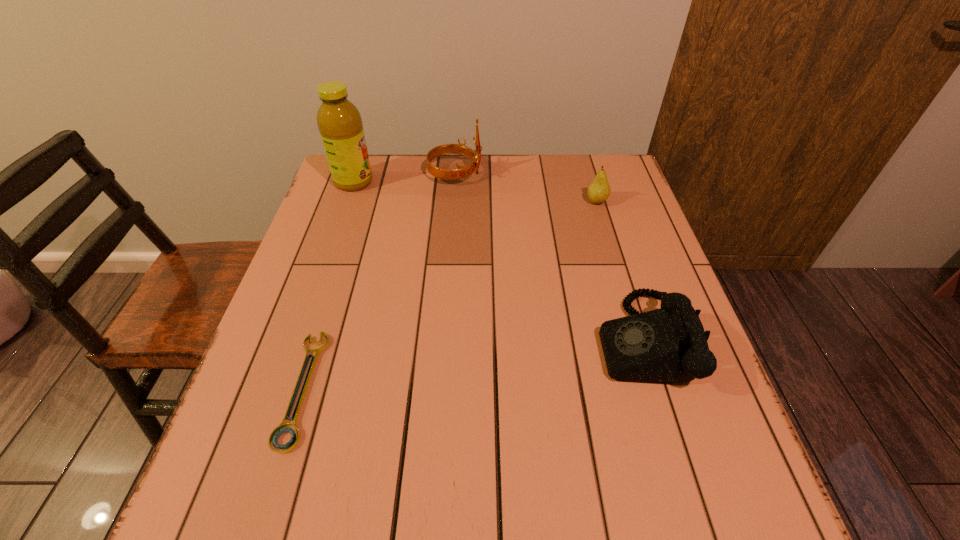
Find the location of a particular element. free region that satisfies the following two spatial constraints: 1. on the front label of the wrench; 2. on the right side of the tallest object is located at coordinates (282, 388).

Where is `free location that satisfies the following two spatial constraints: 1. on the back side of the pear; 2. on the front label of the tallest object`? This screenshot has width=960, height=540. free location that satisfies the following two spatial constraints: 1. on the back side of the pear; 2. on the front label of the tallest object is located at coordinates (590, 182).

Locate an element on the screen. This screenshot has height=540, width=960. blank area in the image that satisfies the following two spatial constraints: 1. on the back side of the pear; 2. on the front-facing side of the third object from left to right is located at coordinates (588, 174).

Identify the location of free location that satisfies the following two spatial constraints: 1. on the back side of the third farthest object; 2. on the front-facing side of the tiara. (588, 174).